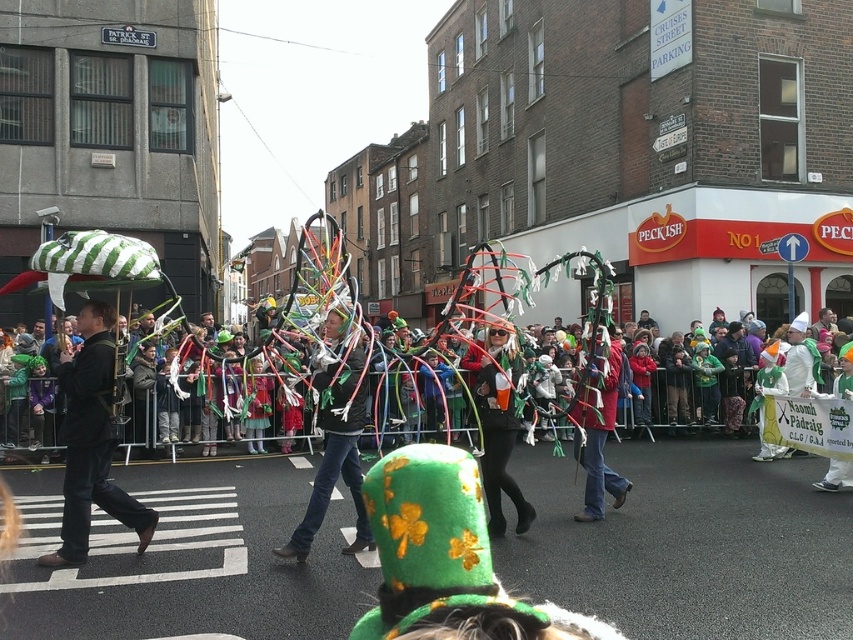
Question: Which of the following is the closest to the observer?

Choices:
 (A) (601, 513)
 (B) (70, 403)
 (C) (280, 440)

Answer: (B)

Question: Is green felt hat at center positioned behind matte red coat at center?

Choices:
 (A) yes
 (B) no

Answer: (B)

Question: Is green fabric crowd at center below matte black jacket at left?

Choices:
 (A) yes
 (B) no

Answer: (A)

Question: Which point is farther to the camera?

Choices:
 (A) (494, 380)
 (B) (358, 518)
 (C) (84, 477)

Answer: (A)

Question: Which is nearer to the matte red coat at center?

Choices:
 (A) matte black jacket at left
 (B) green felt hat at center
 (C) green fabric hat at center

Answer: (B)

Question: Can you confirm if matte black jacket at left is positioned to the right of green felt hat at center?

Choices:
 (A) yes
 (B) no

Answer: (B)